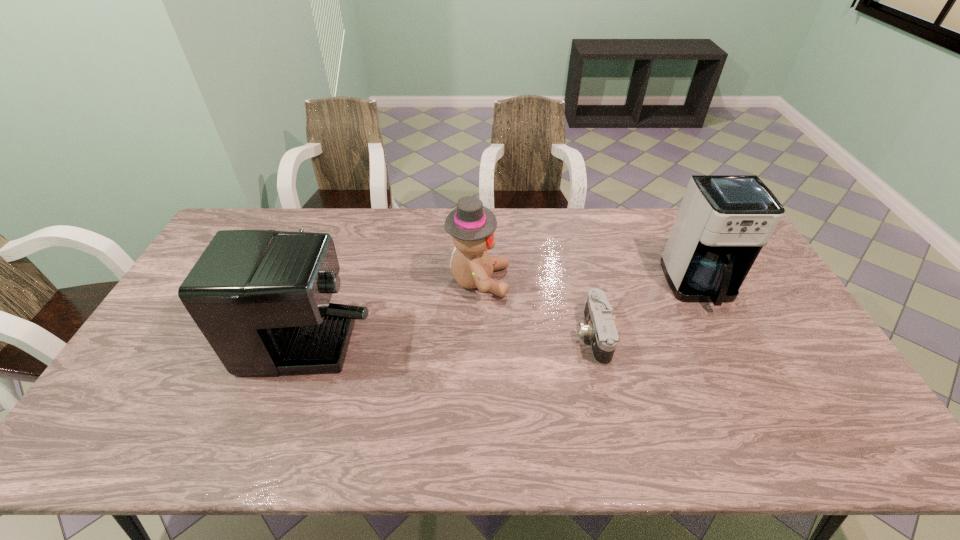
This screenshot has height=540, width=960. Identify the location of the rightmost object. (723, 222).

You are a GUI agent. You are given a task and a screenshot of the screen. Output one action in this format:
    pyautogui.click(x=<x>, y=<y>)
    Task: Click on the left coffee maker
    Image resolution: width=960 pixels, height=540 pixels.
    Given the screenshot: What is the action you would take?
    pyautogui.click(x=261, y=298)

Identify the location of the second object from left to right. (471, 225).

Locate an element on the screen. the third object from left to right is located at coordinates (601, 329).

I want to click on the shortest object, so click(x=601, y=329).

The image size is (960, 540). I want to click on vacant space located 0.340m on the front panel of the rightmost object, so click(x=767, y=420).

Locate an element on the screen. free space located 0.330m on the front-facing side of the left coffee maker is located at coordinates (494, 298).

You are a GUI agent. You are given a task and a screenshot of the screen. Output one action in this format:
    pyautogui.click(x=<x>, y=<y>)
    Task: Click on the blank space located on the front-facing side of the rag_doll
    
    Given the screenshot: What is the action you would take?
    pyautogui.click(x=628, y=280)

You are a GUI agent. You are given a task and a screenshot of the screen. Output one action in this format:
    pyautogui.click(x=<x>, y=<y>)
    Task: Click on the vacant region located 0.150m on the lens of the shortest object
    This screenshot has width=960, height=540.
    Given the screenshot: What is the action you would take?
    pyautogui.click(x=524, y=335)

Image resolution: width=960 pixels, height=540 pixels. I want to click on blank space located 0.050m on the lens of the shortest object, so click(x=560, y=335).